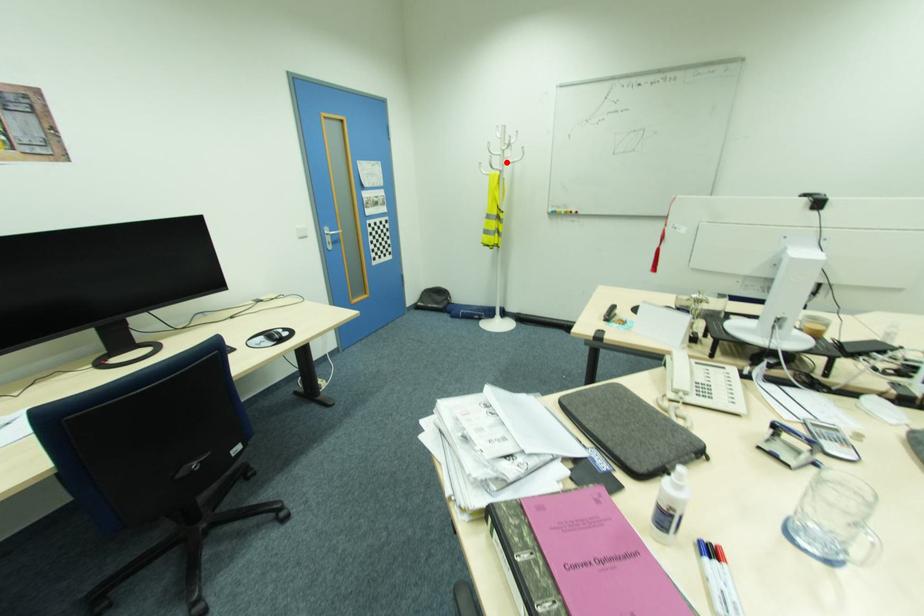
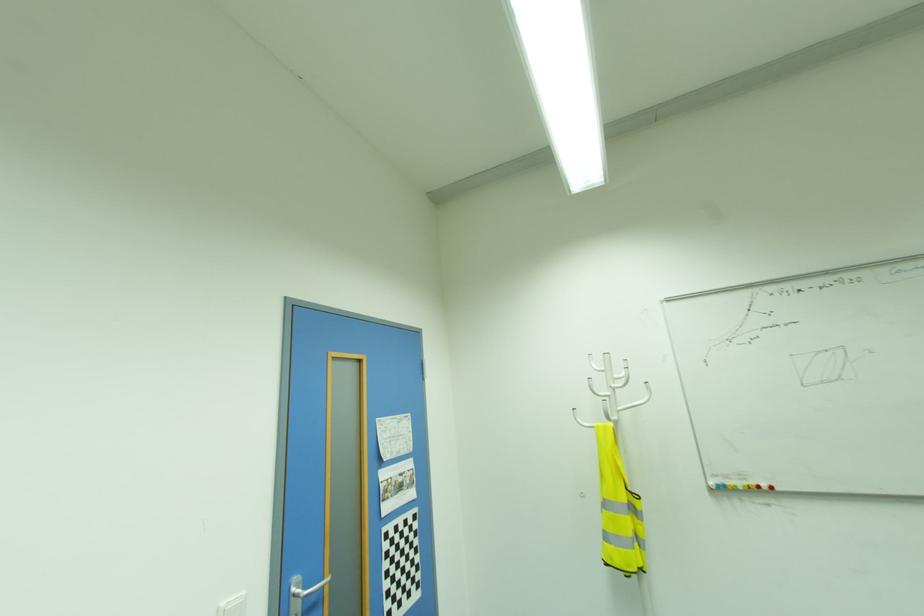
Locate, in the second image, the point that corresponds to the highlighted location in the first image.

(622, 408)